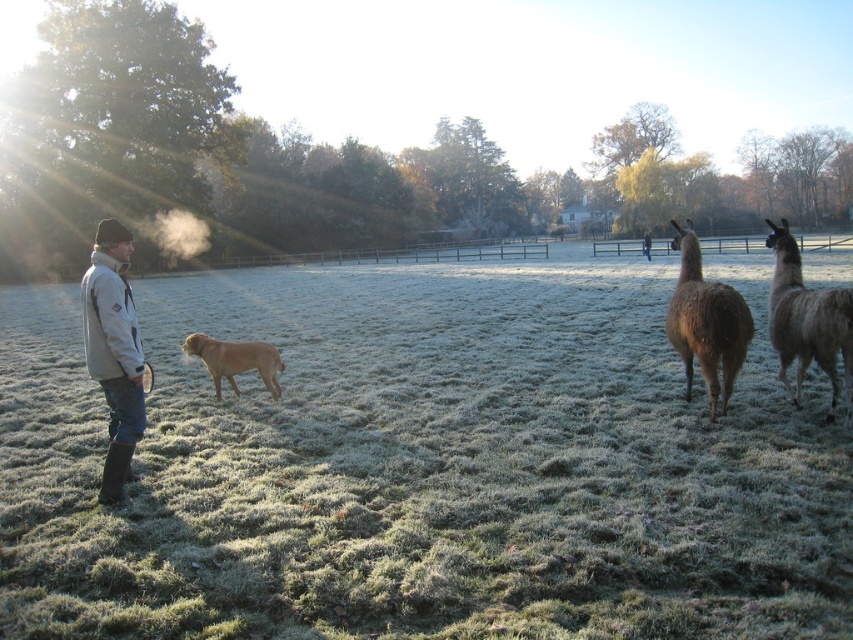
Question: Which object is positioned farthest from the light gray jacket at left?

Choices:
 (A) frosted grass at lower left
 (B) golden brown fur at center

Answer: (A)

Question: Can you confirm if light gray jacket at left is thinner than golden brown fur at center?

Choices:
 (A) yes
 (B) no

Answer: (B)

Question: Estimate the real-world distances between objects in this image. Which object is closer to the frosted grass at lower left?

Choices:
 (A) golden brown fur at center
 (B) light gray jacket at left
 (C) brown woolly alpaca at right

Answer: (A)

Question: Does brown woolly alpaca at right have a lesser width compared to golden brown fur at center?

Choices:
 (A) yes
 (B) no

Answer: (B)

Question: Based on their relative distances, which object is farther from the brown woolly alpaca at right?

Choices:
 (A) golden brown fur at center
 (B) gray woolen alpaca at right
 (C) light gray jacket at left
 (D) light gray jacket at center

Answer: (D)

Question: Is the position of light gray jacket at left more distant than that of gray woolen alpaca at right?

Choices:
 (A) no
 (B) yes

Answer: (A)